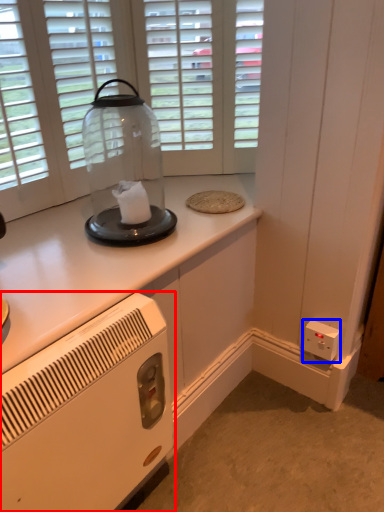
Question: Which of the following is the closest to the observer, home appliance (highlighted by a red box) or electric outlet (highlighted by a blue box)?

Choices:
 (A) home appliance
 (B) electric outlet

Answer: (A)